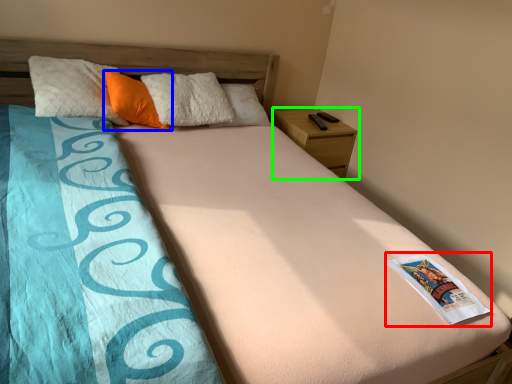
Question: Which object is the farthest from paperback book (highlighted by a red box)? Choose among these: pillow (highlighted by a blue box) or nightstand (highlighted by a green box).

Choices:
 (A) pillow
 (B) nightstand

Answer: (A)